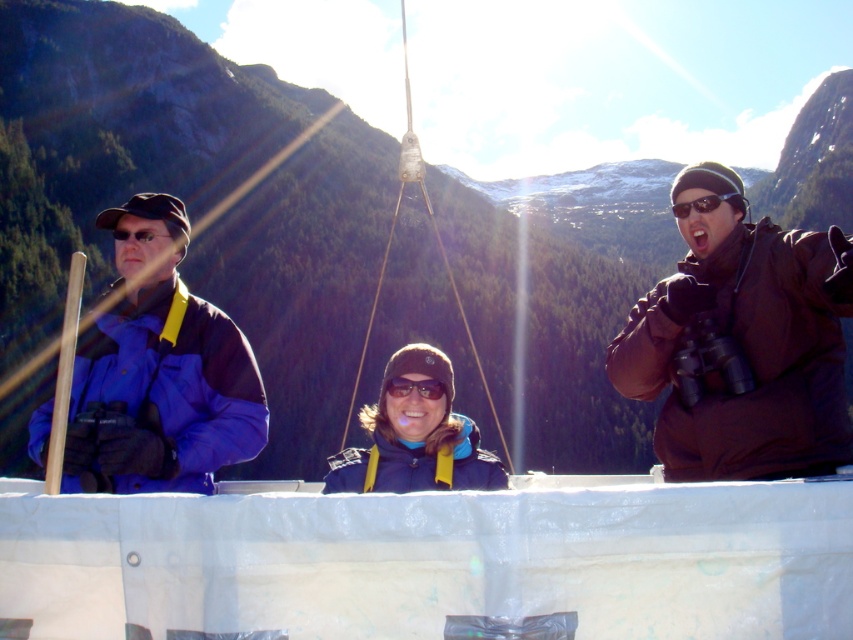
Can you confirm if brown matte jacket at right is positioned below blue fabric jacket at left?

No, brown matte jacket at right is not below blue fabric jacket at left.

You are a GUI agent. You are given a task and a screenshot of the screen. Output one action in this format:
    pyautogui.click(x=<x>, y=<y>)
    Task: Click on the brown matte jacket at right
    The height and width of the screenshot is (640, 853).
    Given the screenshot: What is the action you would take?
    pyautogui.click(x=744, y=349)

Is blue fleece jacket at left in front of blue fleece jacket at center?

That is True.

From the picture: Which is below, blue fleece jacket at left or blue fleece jacket at center?

blue fleece jacket at center is lower down.

Between point (851, 305) and point (439, 477), which one is positioned in front?

Positioned in front is point (851, 305).

Identify the location of blue fleece jacket at left. The height and width of the screenshot is (640, 853). 741,355.

Which is below, purple matte goggles at center or black matte sunglasses at upper right?

Positioned lower is purple matte goggles at center.

Who is higher up, purple matte goggles at center or black matte sunglasses at upper right?

black matte sunglasses at upper right

Image resolution: width=853 pixels, height=640 pixels. Identify the location of purple matte goggles at center. (415, 387).